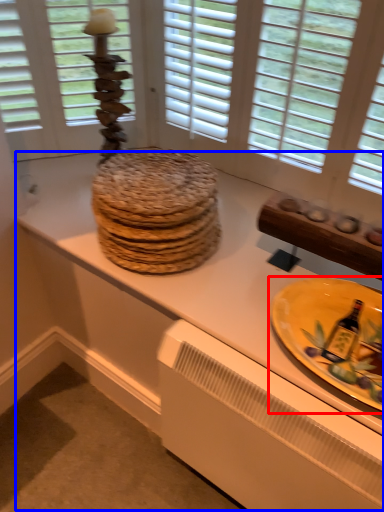
Question: Which of the following is the closest to the observer, plate (highlighted by a red box) or counter top (highlighted by a blue box)?

Choices:
 (A) plate
 (B) counter top

Answer: (A)